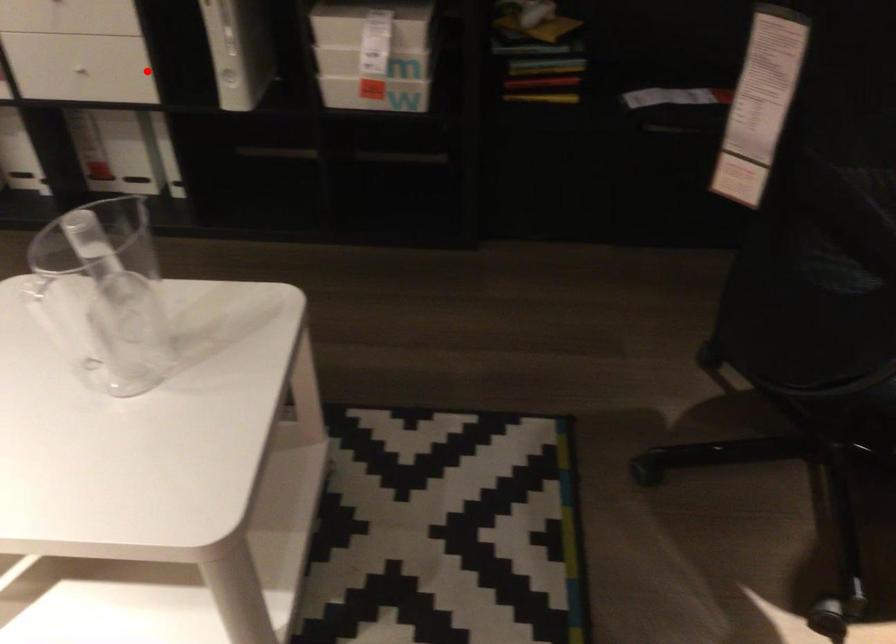
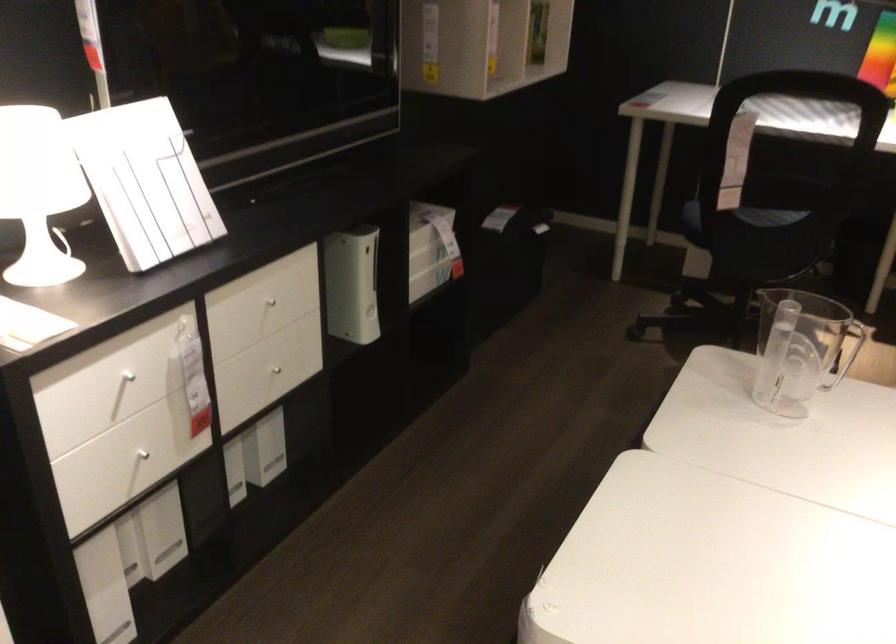
Locate, in the second image, the point that corresponds to the highlighted location in the first image.

(279, 366)